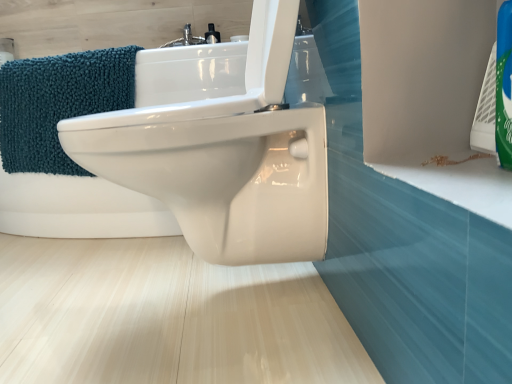
What do you see at coordinates (78, 208) in the screenshot? I see `white glossy bidet at center` at bounding box center [78, 208].

What are the coordinates of `white glossy bidet at center` in the screenshot? It's located at 78,208.

Identify the location of teal chenille bath towel at left. The width and height of the screenshot is (512, 384). (58, 103).

In the scene shown: In order to face teal chenille bath towel at left, should I rotate leftwards or rightwards?

You should look left and rotate roughly 23.271 degrees.

Measure the distance between teal chenille bath towel at left and camera.

teal chenille bath towel at left is 4.19 feet from camera.

The width and height of the screenshot is (512, 384). Describe the element at coordinates (58, 103) in the screenshot. I see `teal chenille bath towel at left` at that location.

At what (x,y) coordinates should I click in order to perform the action: click on white glossy bidet at center. Please return your answer as a coordinate pair (x, y). Looking at the image, I should click on (78, 208).

Is white glossy bidet at center at the right side of teal chenille bath towel at left?

Yes.

Considering the relative positions of white glossy bidet at center and teal chenille bath towel at left in the image provided, is white glossy bidet at center behind teal chenille bath towel at left?

No, white glossy bidet at center is in front of teal chenille bath towel at left.

Is point (100, 187) positioned in front of point (137, 49)?

No, (100, 187) is further to viewer.

From the image's perspective, is white glossy bidet at center located beneath teal chenille bath towel at left?

Incorrect, from the image's perspective, white glossy bidet at center is higher than teal chenille bath towel at left.

From a real-world perspective, which is physically below, white glossy bidet at center or teal chenille bath towel at left?

From a 3D spatial view, white glossy bidet at center is below.

Which object is thinner, white glossy bidet at center or teal chenille bath towel at left?

With smaller width is teal chenille bath towel at left.

Can you confirm if white glossy bidet at center is taller than teal chenille bath towel at left?

Yes, white glossy bidet at center is taller than teal chenille bath towel at left.

Is white glossy bidet at center bigger or smaller than teal chenille bath towel at left?

Considering their sizes, white glossy bidet at center takes up more space than teal chenille bath towel at left.

Could teal chenille bath towel at left be considered to be inside white glossy bidet at center?

Yes, teal chenille bath towel at left can be found within white glossy bidet at center.

Is white glossy bidet at center far away from teal chenille bath towel at left?

No.

Is white glossy bidet at center turned away from teal chenille bath towel at left?

Yes, white glossy bidet at center is facing away from teal chenille bath towel at left.

This screenshot has height=384, width=512. In order to click on bath in front of the teal chenille bath towel at left in this screenshot , I will do `click(78, 208)`.

Is teal chenille bath towel at left to the left of white glossy bidet at center from the viewer's perspective?

Correct, you'll find teal chenille bath towel at left to the left of white glossy bidet at center.

Is teal chenille bath towel at left in front of white glossy bidet at center?

That is False.

Which point is more distant from viewer, (87, 97) or (133, 193)?

The point (133, 193) is farther from the camera.

From the image's perspective, between teal chenille bath towel at left and white glossy bidet at center, who is located below?

teal chenille bath towel at left, from the image's perspective.

From a real-world perspective, who is located lower, teal chenille bath towel at left or white glossy bidet at center?

From a 3D spatial view, white glossy bidet at center is below.

Which object is wider, teal chenille bath towel at left or white glossy bidet at center?

white glossy bidet at center is wider.

Who is taller, teal chenille bath towel at left or white glossy bidet at center?

With more height is white glossy bidet at center.

Considering the relative sizes of teal chenille bath towel at left and white glossy bidet at center in the image provided, is teal chenille bath towel at left bigger than white glossy bidet at center?

Actually, teal chenille bath towel at left might be smaller than white glossy bidet at center.

Consider the image. Would you say teal chenille bath towel at left contains white glossy bidet at center?

No, white glossy bidet at center is not surrounded by teal chenille bath towel at left.

Is teal chenille bath towel at left next to white glossy bidet at center and touching it?

teal chenille bath towel at left and white glossy bidet at center are not in contact.

Is teal chenille bath towel at left turned away from white glossy bidet at center?

That's right, teal chenille bath towel at left is facing away from white glossy bidet at center.

The width and height of the screenshot is (512, 384). Find the location of `bath towel to the left of white glossy bidet at center`. bath towel to the left of white glossy bidet at center is located at coordinates (58, 103).

Identify the location of bath towel that appears above the white glossy bidet at center (from a real-world perspective). The height and width of the screenshot is (384, 512). (58, 103).

Where is `bath in front of the teal chenille bath towel at left`? This screenshot has height=384, width=512. bath in front of the teal chenille bath towel at left is located at coordinates (78, 208).